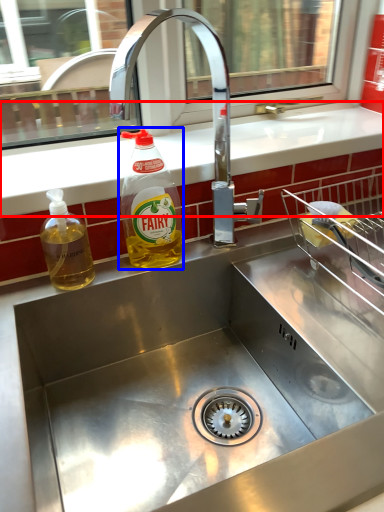
Question: Among these objects, which one is nearest to the camera, counter top (highlighted by a red box) or bottle (highlighted by a blue box)?

Choices:
 (A) counter top
 (B) bottle

Answer: (B)